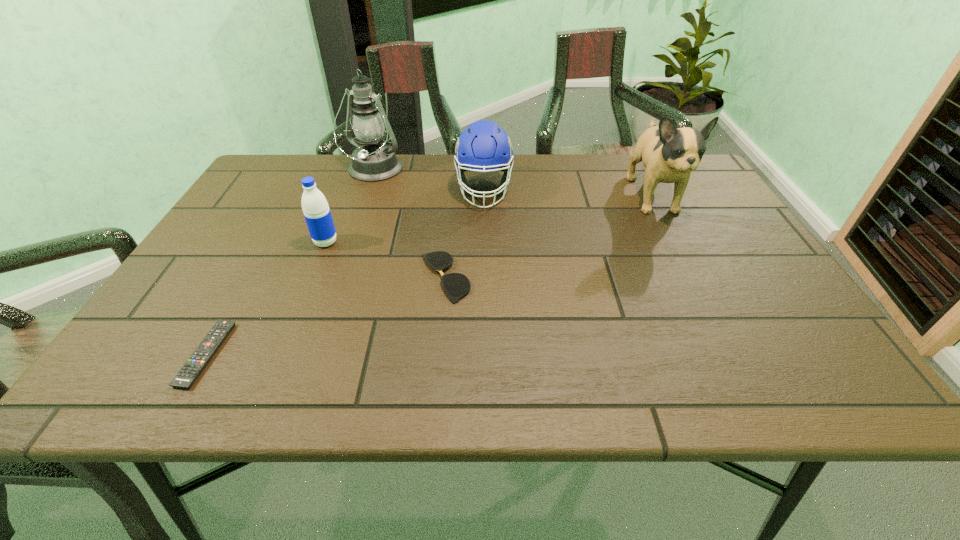
You are a GUI agent. You are given a task and a screenshot of the screen. Output one action in this format:
    pyautogui.click(x=<x>, y=<y>)
    Task: Click on the free spot that satisfies the following two spatial constraints: 1. on the back side of the oil lamp; 2. on the right side of the shortest object
    
    Given the screenshot: What is the action you would take?
    309,170

Identify the location of free spot that satisfies the following two spatial constraints: 1. on the back side of the nearest object; 2. on the left side of the oil lamp. This screenshot has height=540, width=960. (309, 170).